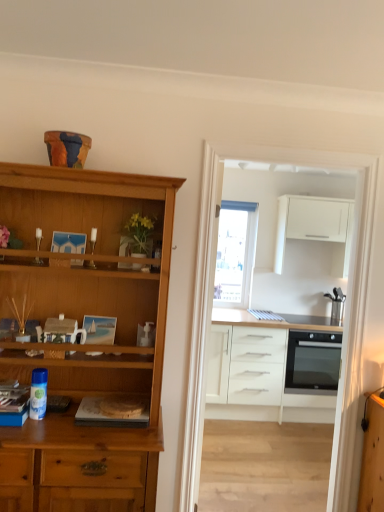
Question: Considering the relative sizes of matte wooden picture frame at center and transparent glass window at center in the image provided, is matte wooden picture frame at center bigger than transparent glass window at center?

Choices:
 (A) no
 (B) yes

Answer: (A)

Question: Does matte wooden picture frame at center appear on the left side of transparent glass window at center?

Choices:
 (A) yes
 (B) no

Answer: (A)

Question: Is matte wooden picture frame at center positioned with its back to transparent glass window at center?

Choices:
 (A) no
 (B) yes

Answer: (B)

Question: From a real-world perspective, is matte wooden picture frame at center located beneath transparent glass window at center?

Choices:
 (A) yes
 (B) no

Answer: (A)

Question: Is transparent glass window at center surrounded by matte wooden picture frame at center?

Choices:
 (A) no
 (B) yes

Answer: (A)

Question: Visually, is transparent glass window at center positioned to the left or to the right of matte wooden picture frame at center?

Choices:
 (A) left
 (B) right

Answer: (B)

Question: Considering the positions of point (251, 275) and point (104, 322), is point (251, 275) closer or farther from the camera than point (104, 322)?

Choices:
 (A) farther
 (B) closer

Answer: (A)

Question: From the image's perspective, is transparent glass window at center located above or below matte wooden picture frame at center?

Choices:
 (A) above
 (B) below

Answer: (A)

Question: In terms of size, does transparent glass window at center appear bigger or smaller than matte wooden picture frame at center?

Choices:
 (A) big
 (B) small

Answer: (A)

Question: From a real-world perspective, is white matte cabinet at upper right, arranged as the 1th cabinetry when viewed from the top, above or below white matte cabinet at center, which is the 2th cabinetry in top-to-bottom order?

Choices:
 (A) below
 (B) above

Answer: (B)

Question: Considering the positions of white matte cabinet at upper right, acting as the second cabinetry starting from the bottom, and white matte cabinet at center, which is the 2th cabinetry in top-to-bottom order, in the image, is white matte cabinet at upper right, acting as the second cabinetry starting from the bottom, wider or thinner than white matte cabinet at center, which is the 2th cabinetry in top-to-bottom order,?

Choices:
 (A) thin
 (B) wide

Answer: (A)

Question: Is white matte cabinet at upper right, acting as the second cabinetry starting from the bottom, to the left or to the right of white matte cabinet at center, which is the 2th cabinetry in top-to-bottom order, in the image?

Choices:
 (A) left
 (B) right

Answer: (B)

Question: Is white matte cabinet at upper right, arranged as the 1th cabinetry when viewed from the top, in front of or behind white matte cabinet at center, which is the 2th cabinetry in top-to-bottom order, in the image?

Choices:
 (A) behind
 (B) front

Answer: (A)

Question: From their relative heights in the image, would you say yellow artificial flowers in plastic at center is taller or shorter than white glossy cabinets at center?

Choices:
 (A) short
 (B) tall

Answer: (A)

Question: Is yellow artificial flowers in plastic at center wider or thinner than white glossy cabinets at center?

Choices:
 (A) wide
 (B) thin

Answer: (A)